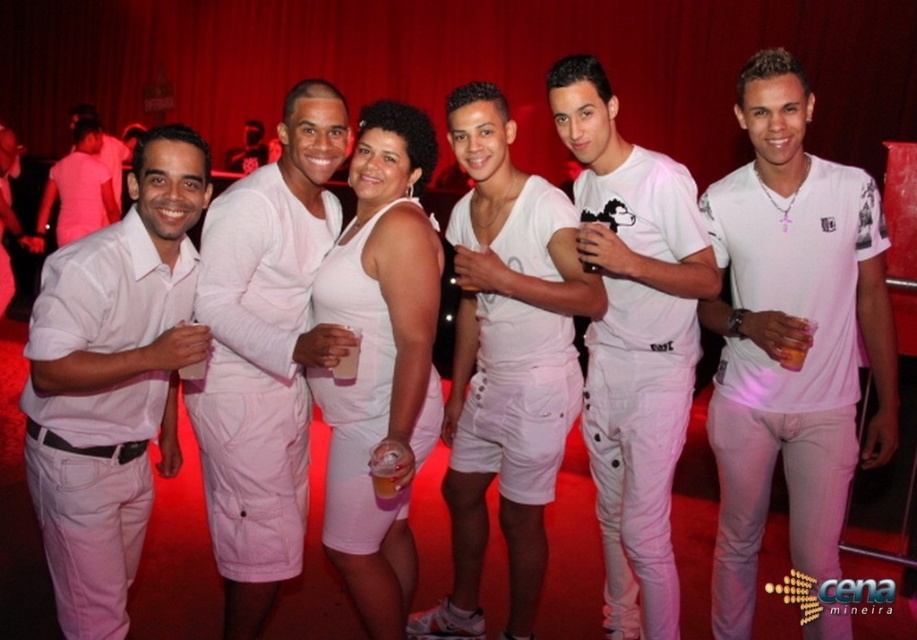
Question: Is white fabric tank top at center below matte white tank top at center?

Choices:
 (A) yes
 (B) no

Answer: (A)

Question: Estimate the real-world distances between objects in this image. Which object is closer to the white matte shirt at center?

Choices:
 (A) matte white tank top at center
 (B) white fabric tank top at center
 (C) matte white shorts at center

Answer: (B)

Question: Among these objects, which one is nearest to the camera?

Choices:
 (A) white matte shirt at center
 (B) matte white tank top at center
 (C) white matte tank top at center

Answer: (C)

Question: Which point is farther from the camera taking this photo?

Choices:
 (A) (299, 458)
 (B) (120, 276)

Answer: (A)

Question: Where is matte white shirt at left located in relation to white fabric tank top at center in the image?

Choices:
 (A) left
 (B) right

Answer: (A)

Question: Does white matte shirt at center appear under matte white shorts at center?

Choices:
 (A) no
 (B) yes

Answer: (A)